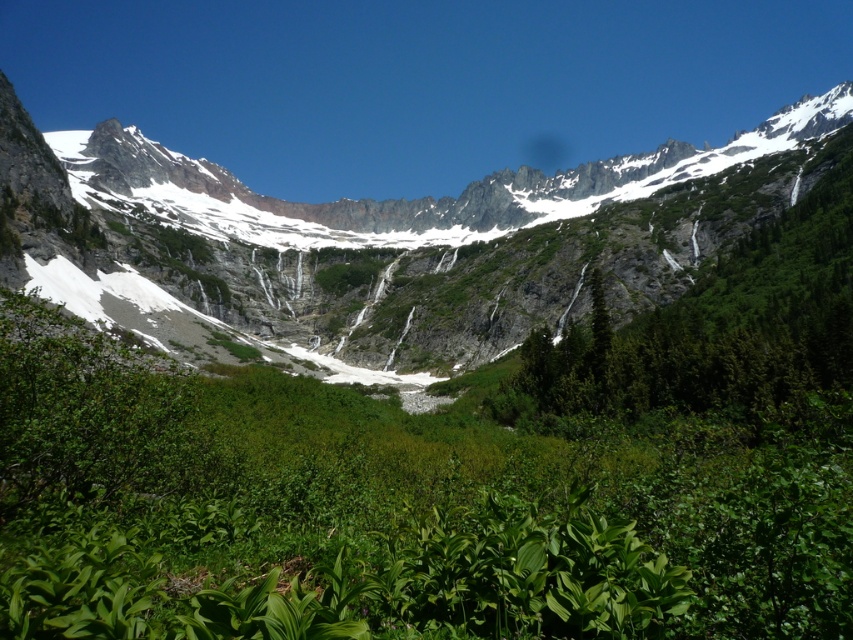
Who is shorter, green mossy rock at center or green leafy tree at upper right?

green leafy tree at upper right is shorter.

Can you confirm if green mossy rock at center is wider than green leafy tree at upper right?

Indeed, green mossy rock at center has a greater width compared to green leafy tree at upper right.

Is point (131, 272) positioned before point (813, 246)?

No, it is behind (813, 246).

What are the coordinates of `green mossy rock at center` in the screenshot? It's located at (389, 246).